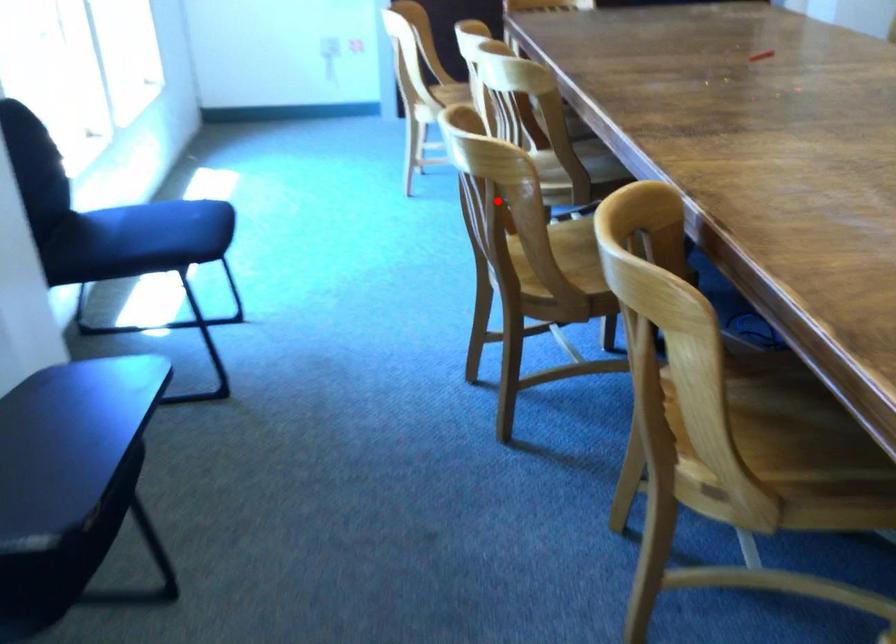
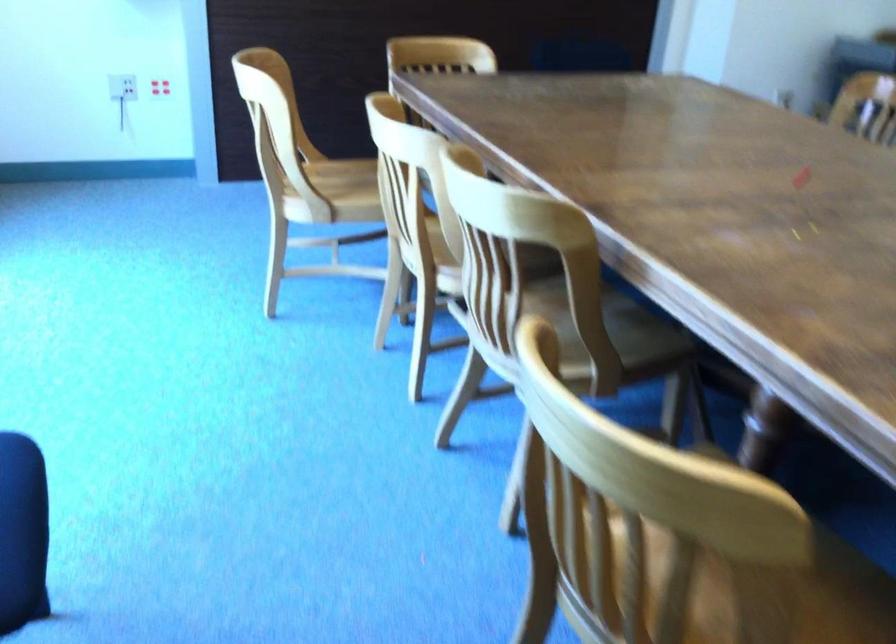
Question: I am providing you with two images of the same scene from different viewpoints. A red point is shown in image1. For the corresponding object point in image2, is it positioned nearer or farther from the camera?

Choices:
 (A) Nearer
 (B) Farther

Answer: (A)